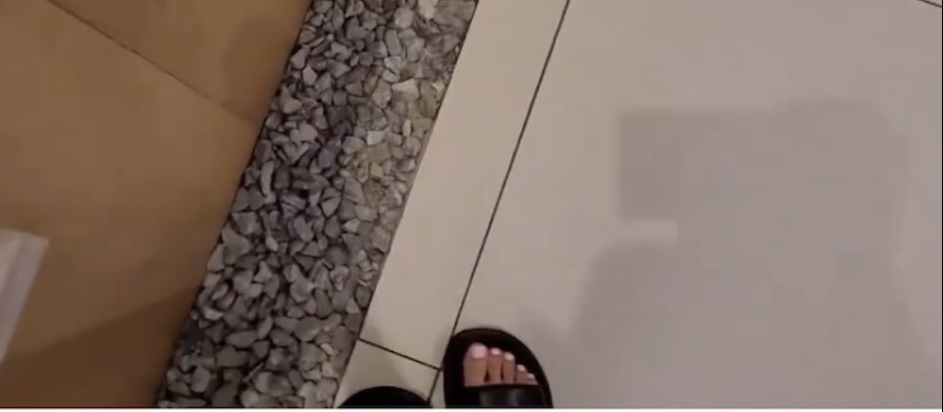
This screenshot has height=412, width=943. I want to click on empty space top right floor, so click(738, 70).